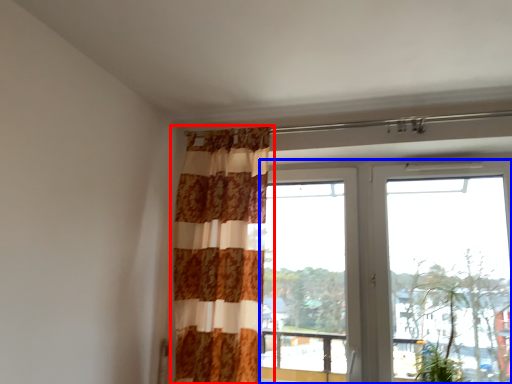
Question: Among these objects, which one is nearest to the camera, curtain (highlighted by a red box) or window (highlighted by a blue box)?

Choices:
 (A) curtain
 (B) window

Answer: (B)